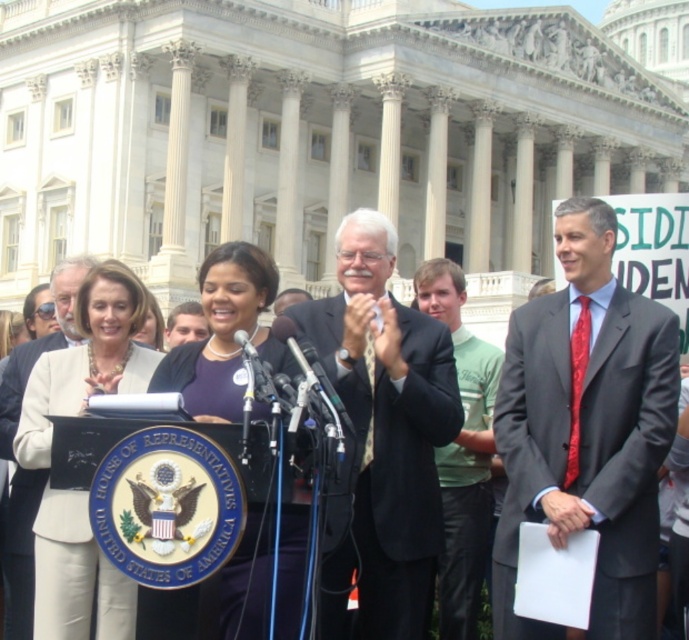
You are attending a formal event and notice two people on stage. One is wearing a matte purple dress at center and the other a green cotton shirt at center. Which one is standing in front?

The matte purple dress at center is closer to the viewer than the green cotton shirt at center, so the person in the matte purple dress at center is standing in front.